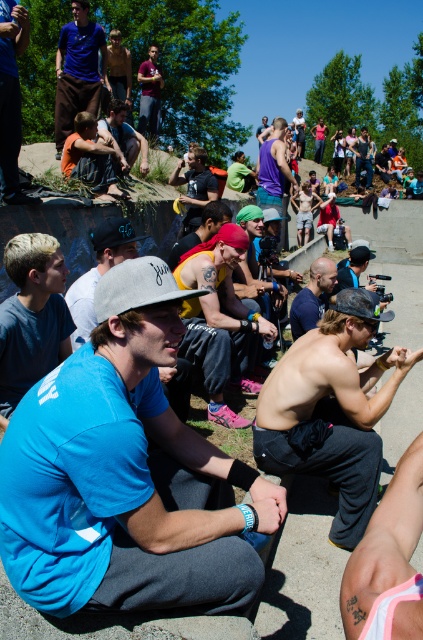
Question: Which object appears closest to the camera in this image?

Choices:
 (A) matte blue shirt at center
 (B) matte purple tank top at center
 (C) matte blue shirt at upper left
 (D) gray fabric baseball cap at center

Answer: (D)

Question: Which point is closer to the camera taking this photo?

Choices:
 (A) (90, 160)
 (B) (131, 284)
 (C) (74, 61)
 (D) (35, 365)

Answer: (B)

Question: Can you confirm if blue fabric shirt at center is positioned to the right of yellow t-shirt at center?

Choices:
 (A) yes
 (B) no

Answer: (B)

Question: From the image, what is the correct spatial relationship of matte black cap at center in relation to multicolored bandana at center?

Choices:
 (A) right
 (B) left

Answer: (B)

Question: Does matte blue shirt at center lie in front of blue t-shirt at center?

Choices:
 (A) no
 (B) yes

Answer: (B)

Question: Which is farther from the matte blue shirt at center?

Choices:
 (A) matte purple tank top at center
 (B) blue fabric shirt at center
 (C) matte black cap at center
 (D) matte brown shirt at center

Answer: (A)